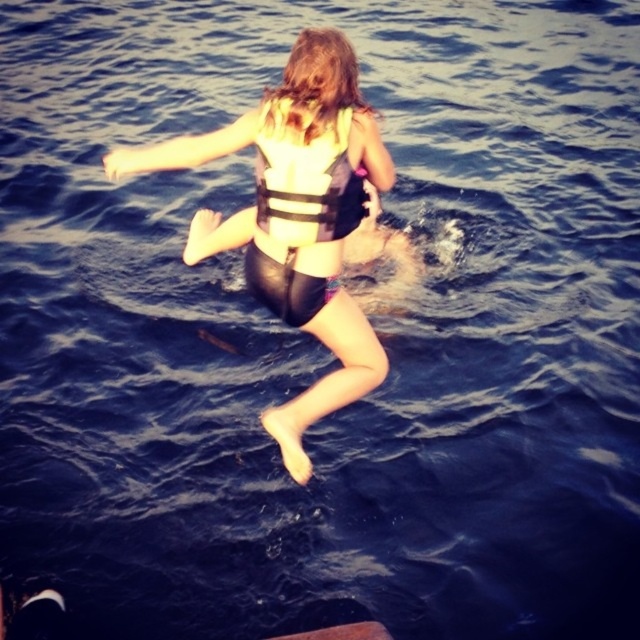
In the scene shown: Is matte black swimsuit at center to the right of yellow fabric life jacket at center from the viewer's perspective?

Incorrect, matte black swimsuit at center is not on the right side of yellow fabric life jacket at center.

Measure the distance between matte black swimsuit at center and yellow fabric life jacket at center.

matte black swimsuit at center and yellow fabric life jacket at center are 5.10 inches apart from each other.

The height and width of the screenshot is (640, 640). What are the coordinates of `matte black swimsuit at center` in the screenshot? It's located at (x=296, y=218).

Identify the location of matte black swimsuit at center. [296, 218].